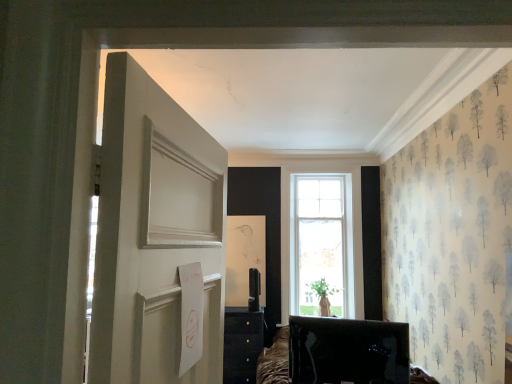
The image size is (512, 384). In order to click on white painted wood door at left in this screenshot , I will do `click(153, 233)`.

Describe the element at coordinates (153, 233) in the screenshot. I see `white painted wood door at left` at that location.

Find the location of `matte black tv at lower center`. matte black tv at lower center is located at coordinates (347, 351).

What do you see at coordinates (347, 351) in the screenshot? Image resolution: width=512 pixels, height=384 pixels. I see `matte black tv at lower center` at bounding box center [347, 351].

Where is `white painted wood door at left`? This screenshot has height=384, width=512. white painted wood door at left is located at coordinates (153, 233).

Is matte black tv at lower center to the left of white painted wood door at left from the viewer's perspective?

No, matte black tv at lower center is not to the left of white painted wood door at left.

In the image, is matte black tv at lower center positioned in front of or behind white painted wood door at left?

In the image, matte black tv at lower center appears behind white painted wood door at left.

Which is in front, point (308, 383) or point (120, 134)?

Positioned in front is point (120, 134).

From the image's perspective, is matte black tv at lower center over white painted wood door at left?

Incorrect, from the image's perspective, matte black tv at lower center is lower than white painted wood door at left.

From a real-world perspective, is matte black tv at lower center over white painted wood door at left?

No, from a real-world perspective, matte black tv at lower center is not over white painted wood door at left

In the scene shown: Considering the sizes of objects matte black tv at lower center and white painted wood door at left in the image provided, who is thinner, matte black tv at lower center or white painted wood door at left?

Thinner between the two is white painted wood door at left.

Considering the relative sizes of matte black tv at lower center and white painted wood door at left in the image provided, is matte black tv at lower center shorter than white painted wood door at left?

Indeed, matte black tv at lower center has a lesser height compared to white painted wood door at left.

Who is smaller, matte black tv at lower center or white painted wood door at left?

matte black tv at lower center is smaller.

Is matte black tv at lower center not inside white painted wood door at left?

Yes, matte black tv at lower center is not within white painted wood door at left.

Would you consider matte black tv at lower center to be distant from white painted wood door at left?

Absolutely, matte black tv at lower center is distant from white painted wood door at left.

Based on the photo, is matte black tv at lower center looking in the opposite direction of white painted wood door at left?

Correct, matte black tv at lower center is looking away from white painted wood door at left.

How far apart are matte black tv at lower center and white painted wood door at left?

matte black tv at lower center and white painted wood door at left are 7.32 feet apart.

In order to click on furniture directly beneath the white painted wood door at left (from a real-world perspective) in this screenshot , I will do `click(347, 351)`.

Based on the photo, considering the positions of objects white painted wood door at left and matte black tv at lower center in the image provided, who is more to the left, white painted wood door at left or matte black tv at lower center?

white painted wood door at left.

Between white painted wood door at left and matte black tv at lower center, which one is positioned behind?

Positioned behind is matte black tv at lower center.

Which is in front, point (159, 251) or point (395, 351)?

The point (159, 251) is more forward.

From the image's perspective, is white painted wood door at left beneath matte black tv at lower center?

Incorrect, from the image's perspective, white painted wood door at left is higher than matte black tv at lower center.

From a real-world perspective, relative to matte black tv at lower center, is white painted wood door at left vertically above or below?

Clearly, from a real-world perspective, white painted wood door at left is above matte black tv at lower center.

Which object is thinner, white painted wood door at left or matte black tv at lower center?

With smaller width is white painted wood door at left.

Considering the sizes of objects white painted wood door at left and matte black tv at lower center in the image provided, who is taller, white painted wood door at left or matte black tv at lower center?

With more height is white painted wood door at left.

Which of these two, white painted wood door at left or matte black tv at lower center, is smaller?

Smaller between the two is matte black tv at lower center.

Is white painted wood door at left inside or outside of matte black tv at lower center?

white painted wood door at left is outside matte black tv at lower center.

Is white painted wood door at left positioned far away from matte black tv at lower center?

Yes, white painted wood door at left and matte black tv at lower center are quite far apart.

Is white painted wood door at left facing away from matte black tv at lower center?

No, white painted wood door at left is not facing away from matte black tv at lower center.

Can you tell me how much white painted wood door at left and matte black tv at lower center differ in facing direction?

They differ by 93.1 degrees in their facing directions.

Locate an element on the screen. The image size is (512, 384). door above the matte black tv at lower center (from the image's perspective) is located at coordinates (153, 233).

Identify the location of door above the matte black tv at lower center (from the image's perspective). The width and height of the screenshot is (512, 384). (153, 233).

Where is `door that appears in front of the matte black tv at lower center`? door that appears in front of the matte black tv at lower center is located at coordinates (153, 233).